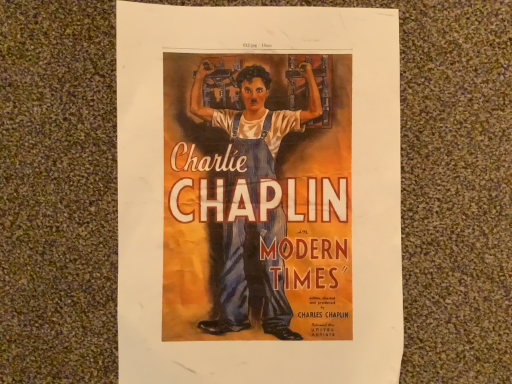
Locate an element on the screen. This screenshot has width=512, height=384. free space above denim overalls at center (from a real-world perspective) is located at coordinates (261, 210).